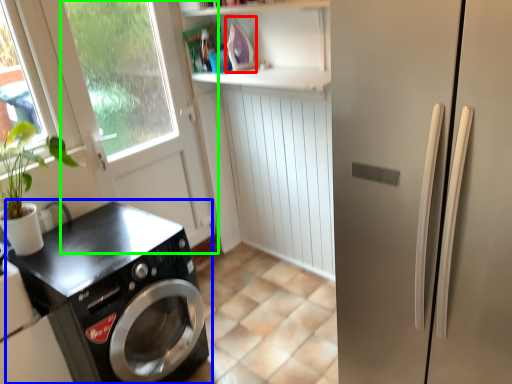
Question: Estimate the real-world distances between objects in this image. Which object is closer to appliance (highlighted by a red box), washing machine (highlighted by a blue box) or screen door (highlighted by a green box)?

Choices:
 (A) washing machine
 (B) screen door

Answer: (B)